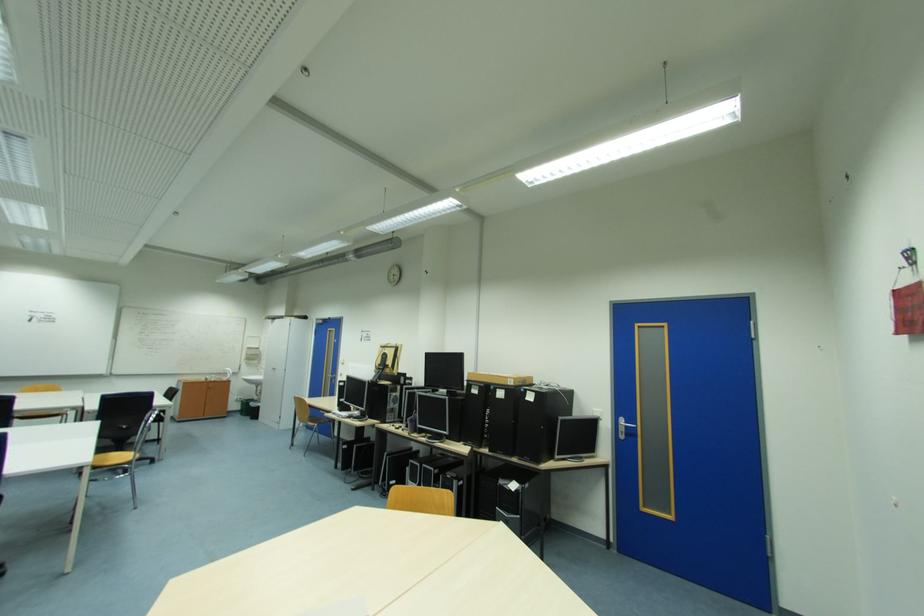
Describe the element at coordinates (112, 459) in the screenshot. I see `the chair sitting surface` at that location.